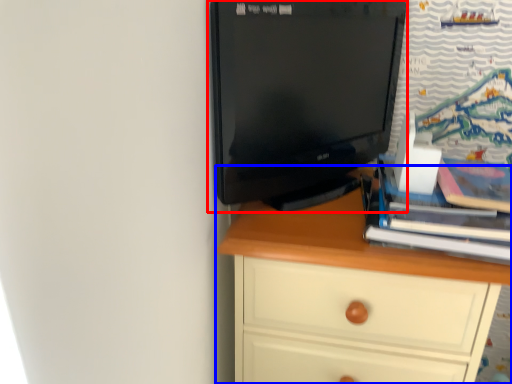
Question: Which point is closer to the camera, computer monitor (highlighted by a red box) or chest of drawers (highlighted by a blue box)?

Choices:
 (A) computer monitor
 (B) chest of drawers

Answer: (A)